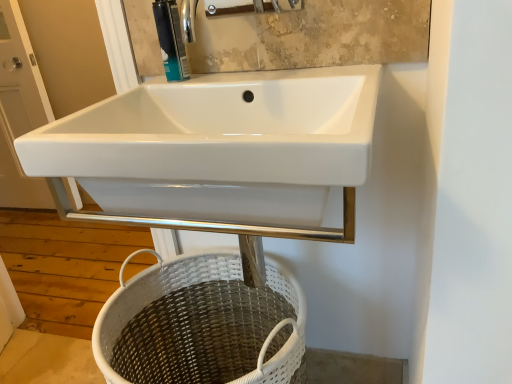
Question: From the image's perspective, is white glossy sink at upper left under white wicker basket at lower center?

Choices:
 (A) no
 (B) yes

Answer: (A)

Question: Considering the relative sizes of white glossy sink at upper left and white wicker basket at lower center in the image provided, is white glossy sink at upper left thinner than white wicker basket at lower center?

Choices:
 (A) no
 (B) yes

Answer: (B)

Question: Is white glossy sink at upper left taller than white wicker basket at lower center?

Choices:
 (A) no
 (B) yes

Answer: (B)

Question: Considering the relative sizes of white glossy sink at upper left and white wicker basket at lower center in the image provided, is white glossy sink at upper left bigger than white wicker basket at lower center?

Choices:
 (A) yes
 (B) no

Answer: (B)

Question: Is white wicker basket at lower center at the back of white glossy sink at upper left?

Choices:
 (A) no
 (B) yes

Answer: (A)

Question: Is white glossy sink at upper left taller or shorter than matte plastic soap dispenser at upper center?

Choices:
 (A) short
 (B) tall

Answer: (B)

Question: Considering their positions, is white glossy sink at upper left located in front of or behind matte plastic soap dispenser at upper center?

Choices:
 (A) front
 (B) behind

Answer: (B)

Question: From a real-world perspective, is white glossy sink at upper left above or below matte plastic soap dispenser at upper center?

Choices:
 (A) below
 (B) above

Answer: (A)

Question: Is white glossy sink at upper left spatially inside matte plastic soap dispenser at upper center, or outside of it?

Choices:
 (A) outside
 (B) inside

Answer: (A)

Question: From the image's perspective, relative to matte plastic soap dispenser at upper center, is white wicker basket at lower center above or below?

Choices:
 (A) below
 (B) above

Answer: (A)

Question: In terms of size, does white wicker basket at lower center appear bigger or smaller than matte plastic soap dispenser at upper center?

Choices:
 (A) small
 (B) big

Answer: (B)

Question: From a real-world perspective, is white wicker basket at lower center positioned above or below matte plastic soap dispenser at upper center?

Choices:
 (A) above
 (B) below

Answer: (B)

Question: Is white wicker basket at lower center inside or outside of matte plastic soap dispenser at upper center?

Choices:
 (A) outside
 (B) inside

Answer: (A)

Question: Considering their positions, is white glossy sink at upper left located in front of or behind white wicker basket at lower center?

Choices:
 (A) behind
 (B) front

Answer: (A)

Question: In terms of height, does white glossy sink at upper left look taller or shorter compared to white wicker basket at lower center?

Choices:
 (A) tall
 (B) short

Answer: (A)